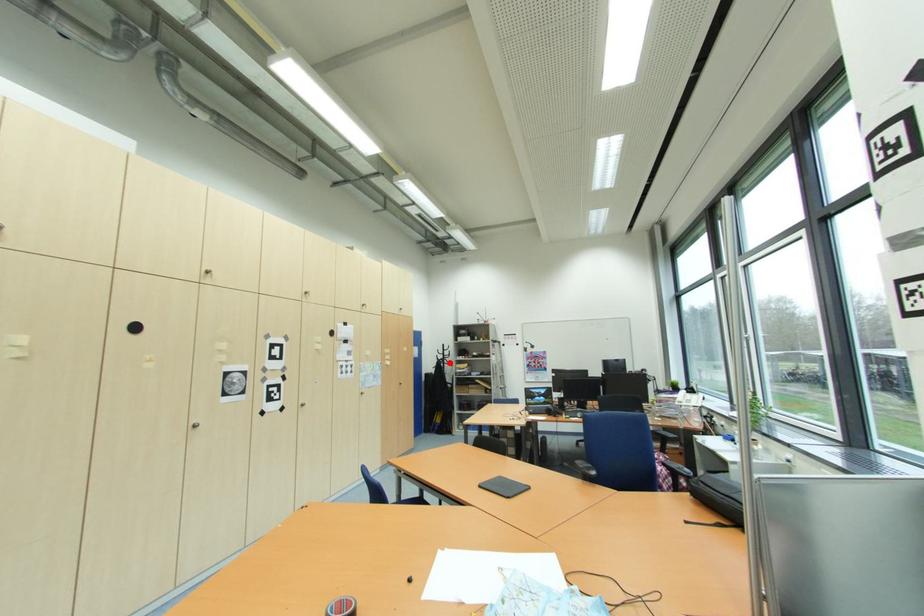
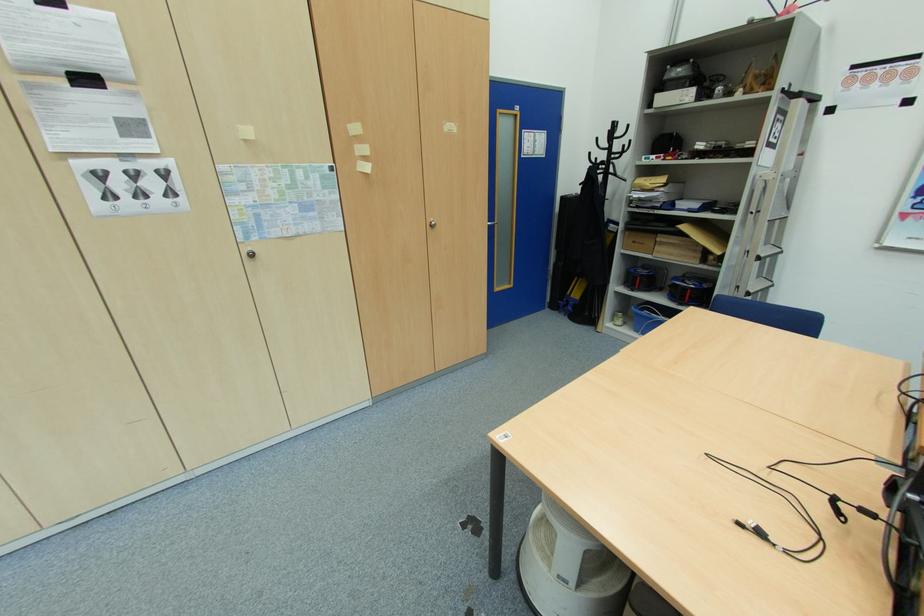
The point at the highlighted location is marked in the first image. Where is the corresponding point in the second image?

(614, 169)